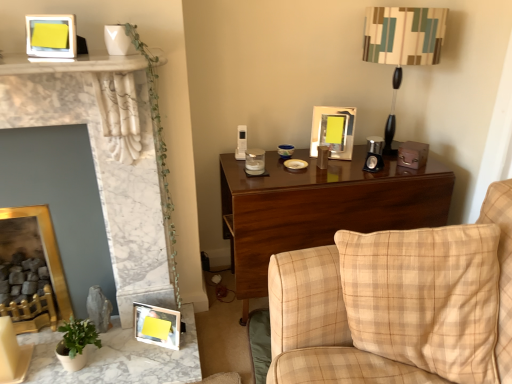
This screenshot has height=384, width=512. In order to click on vacant space to the left of green matte plant at lower left in this screenshot , I will do (x=45, y=358).